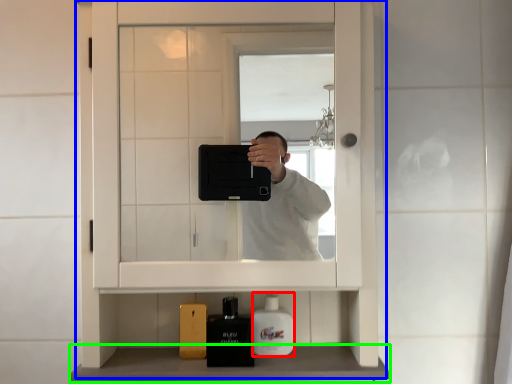
Question: Considering the real-world distances, which object is farthest from mouthwash (highlighted by a red box)? medicine cabinet (highlighted by a blue box) or counter top (highlighted by a green box)?

Choices:
 (A) medicine cabinet
 (B) counter top

Answer: (A)